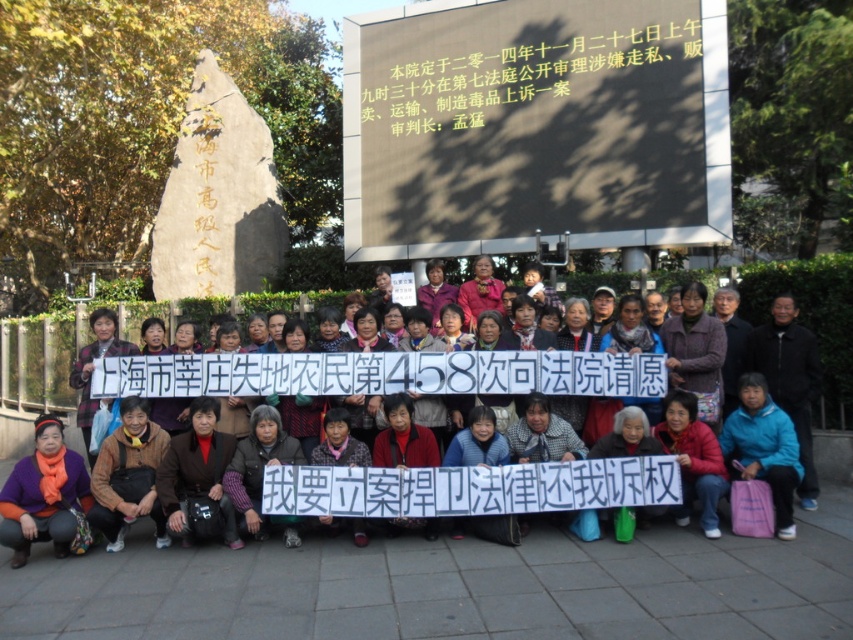
Between point (815, 408) and point (56, 468), which one is positioned behind?

Point (815, 408)

Is blue fabric scarf at center thinner than orange scarf at lower left?

Incorrect, blue fabric scarf at center's width is not less than orange scarf at lower left's.

Between point (657, 273) and point (16, 531), which one is positioned in front?

Point (16, 531) is more forward.

Locate an element on the screen. The image size is (853, 640). blue fabric scarf at center is located at coordinates (805, 321).